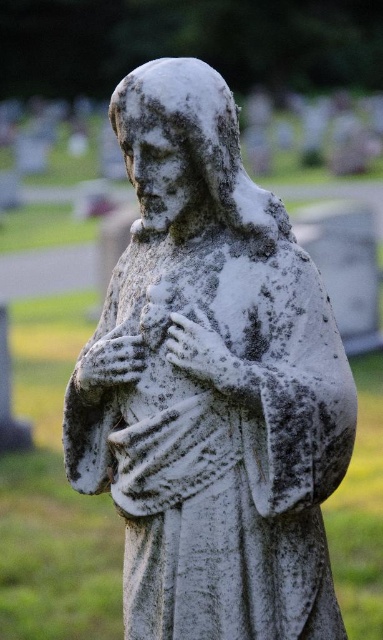
Can you confirm if white marble statue at center is positioned to the left of white stone hand at center?

Correct, you'll find white marble statue at center to the left of white stone hand at center.

Who is taller, white marble statue at center or white stone hand at center?

white marble statue at center

Locate an element on the screen. This screenshot has width=383, height=640. white marble statue at center is located at coordinates (212, 387).

I want to click on white marble statue at center, so click(212, 387).